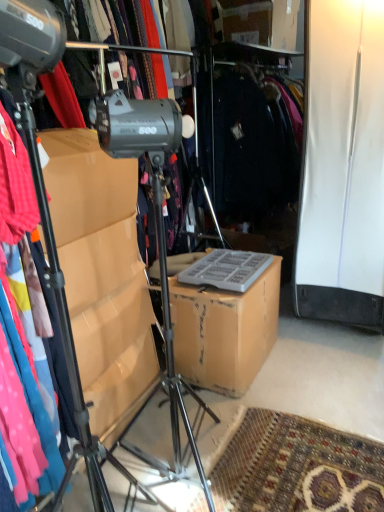
Question: Considering the positions of point (130, 482) and point (213, 321), is point (130, 482) closer or farther from the camera than point (213, 321)?

Choices:
 (A) farther
 (B) closer

Answer: (B)

Question: Is metallic tripod at left bigger or smaller than brown cardboard box at center?

Choices:
 (A) big
 (B) small

Answer: (A)

Question: In terms of width, does metallic tripod at left look wider or thinner when compared to brown cardboard box at center?

Choices:
 (A) thin
 (B) wide

Answer: (B)

Question: Is point (208, 303) positioned closer to the camera than point (41, 174)?

Choices:
 (A) farther
 (B) closer

Answer: (A)

Question: Is brown cardboard box at center to the left or to the right of metallic tripod at left in the image?

Choices:
 (A) right
 (B) left

Answer: (A)

Question: Considering their positions, is brown cardboard box at center located in front of or behind metallic tripod at left?

Choices:
 (A) behind
 (B) front

Answer: (A)

Question: In terms of size, does brown cardboard box at center appear bigger or smaller than metallic tripod at left?

Choices:
 (A) big
 (B) small

Answer: (B)